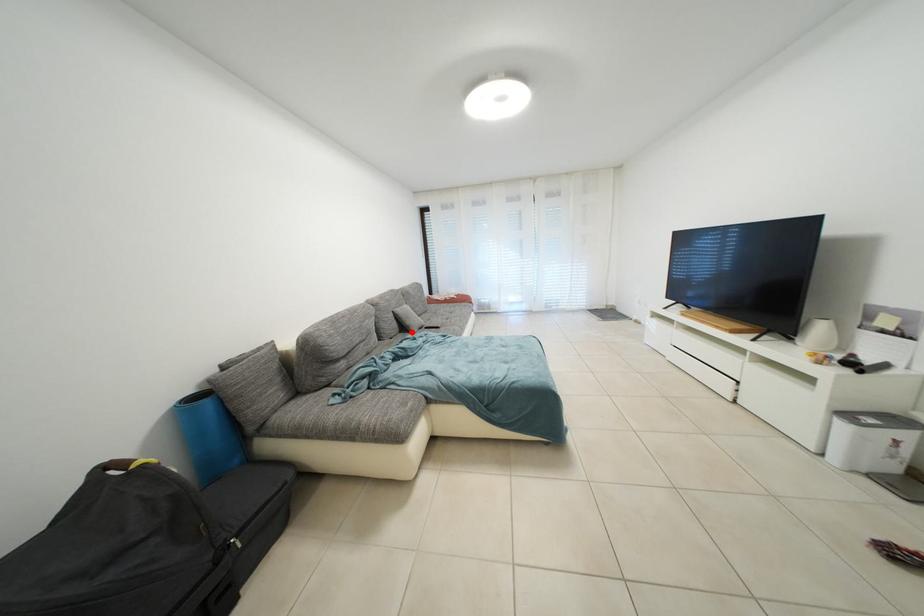
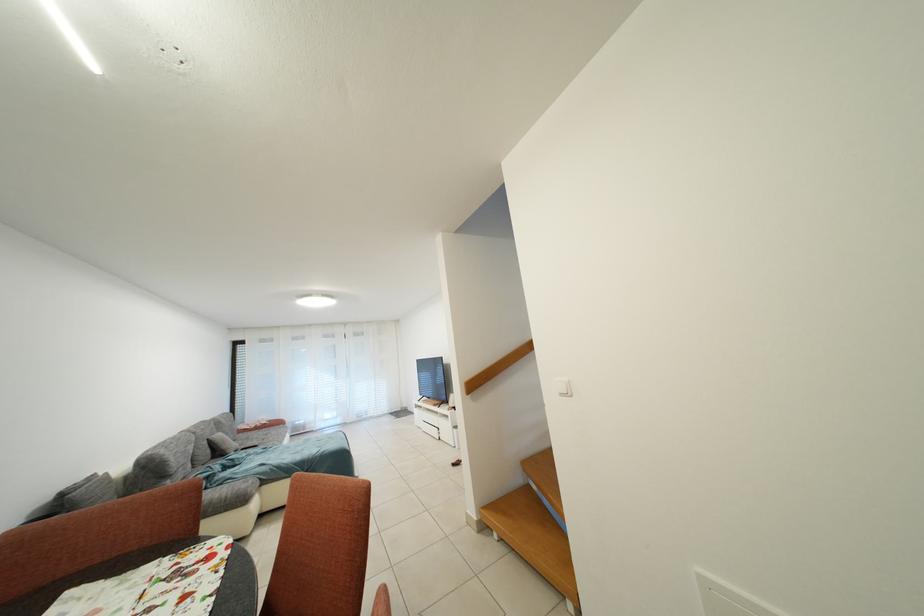
Locate, in the second image, the point that corresponds to the highlighted location in the first image.

(226, 456)